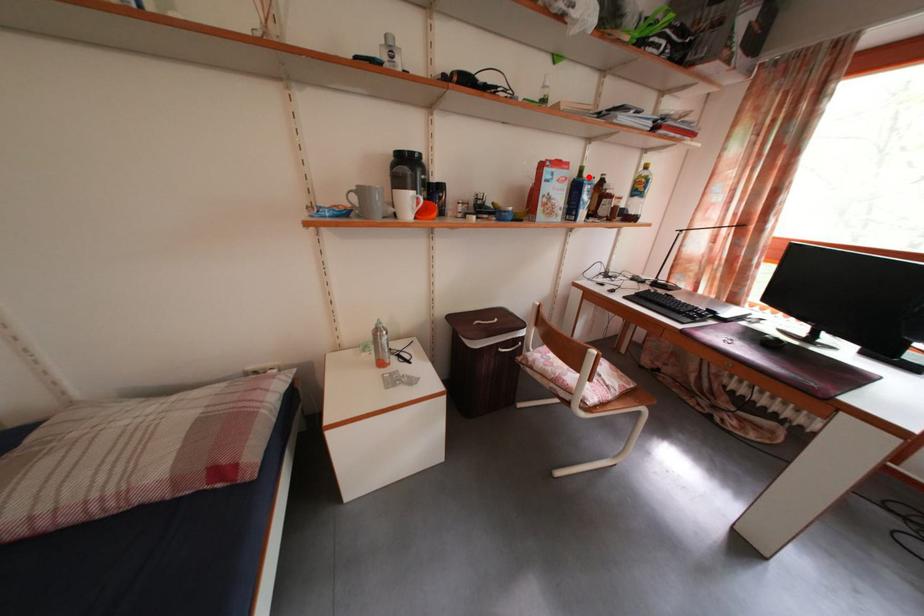
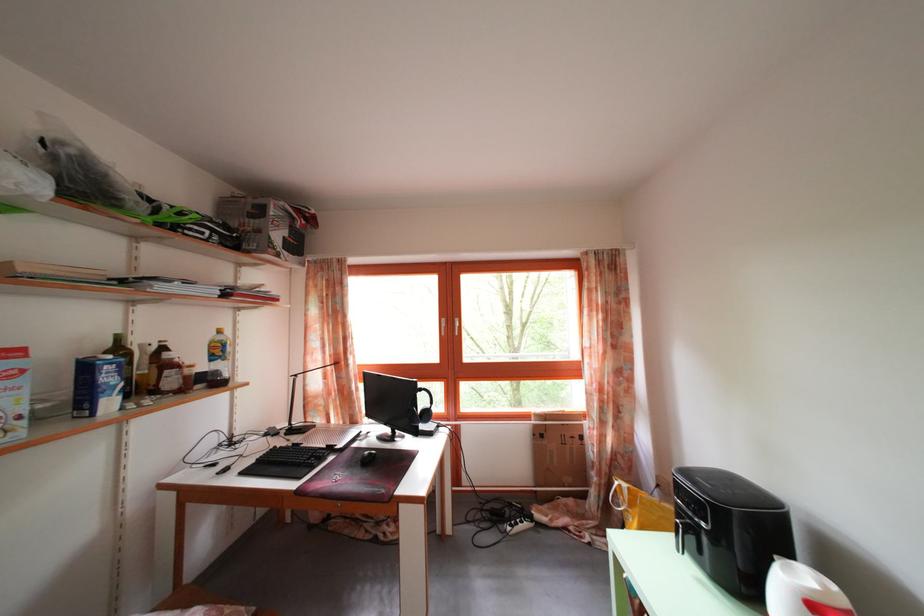
In the second image, find the point that corresponds to the highlighted location in the first image.

(126, 346)